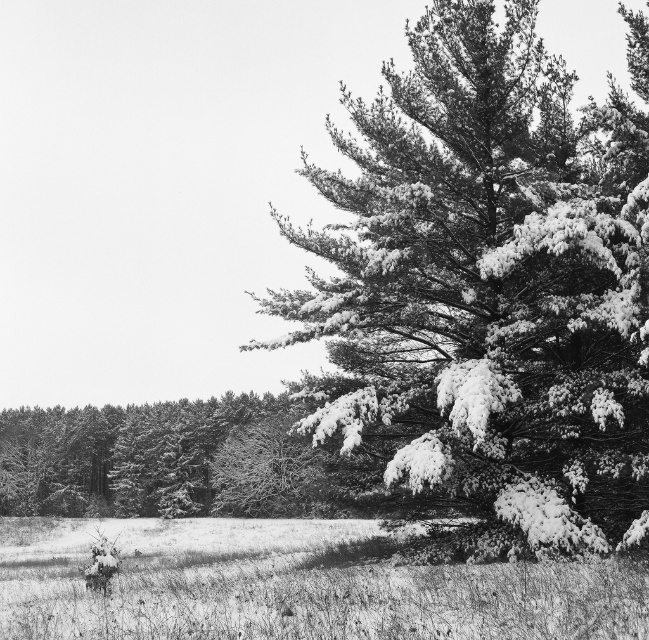
In the scene shown: Can you confirm if snowy grass at lower center is positioned above snow-covered pine tree at center?

Actually, snowy grass at lower center is below snow-covered pine tree at center.

Does point (38, 557) lie behind point (204, 449)?

No.

I want to click on snowy grass at lower center, so click(x=295, y=586).

You are a GUI agent. You are given a task and a screenshot of the screen. Output one action in this format:
    pyautogui.click(x=<x>, y=<y>)
    Task: Click on the snowy grass at lower center
    The height and width of the screenshot is (640, 649).
    Given the screenshot: What is the action you would take?
    pyautogui.click(x=295, y=586)

Can you confirm if snow-covered pine tree at right is taller than snowy grass at lower center?

Yes, snow-covered pine tree at right is taller than snowy grass at lower center.

Measure the distance between snow-covered pine tree at right and camera.

snow-covered pine tree at right is 62.65 feet away from camera.

Locate an element on the screen. This screenshot has width=649, height=640. snow-covered pine tree at right is located at coordinates (487, 289).

Who is taller, snow-covered pine tree at right or snow-covered pine tree at center?

snow-covered pine tree at right is taller.

Find the location of a particular element. The image size is (649, 640). snow-covered pine tree at right is located at coordinates (487, 289).

Where is `snow-covered pine tree at right`? This screenshot has height=640, width=649. snow-covered pine tree at right is located at coordinates (487, 289).